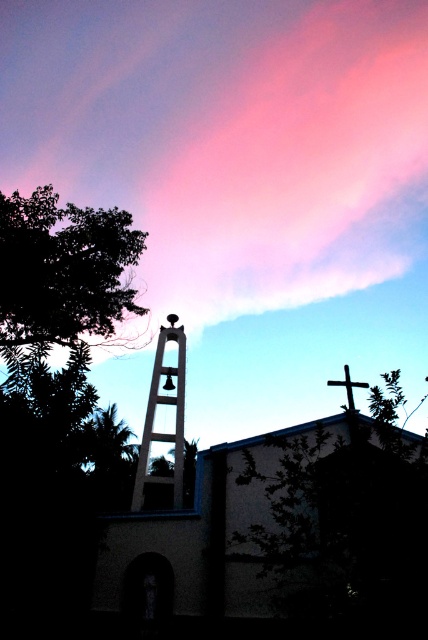
Can you confirm if dark green leafy tree at left is shorter than metallic bell tower at center?

Yes, dark green leafy tree at left is shorter than metallic bell tower at center.

Does dark green leafy tree at left have a greater width compared to metallic bell tower at center?

Yes, dark green leafy tree at left is wider than metallic bell tower at center.

Does point (55, 264) lie behind point (145, 426)?

No, it is not.

Where is `dark green leafy tree at left`? dark green leafy tree at left is located at coordinates (65, 272).

The image size is (428, 640). What do you see at coordinates (228, 138) in the screenshot?
I see `pink cloud at upper center` at bounding box center [228, 138].

The width and height of the screenshot is (428, 640). Find the location of `pink cloud at upper center`. pink cloud at upper center is located at coordinates (228, 138).

Who is lower down, dark green leafy tree at left or metallic cross at upper center?

Positioned lower is metallic cross at upper center.

Find the location of `dark green leafy tree at left`. dark green leafy tree at left is located at coordinates (65, 272).